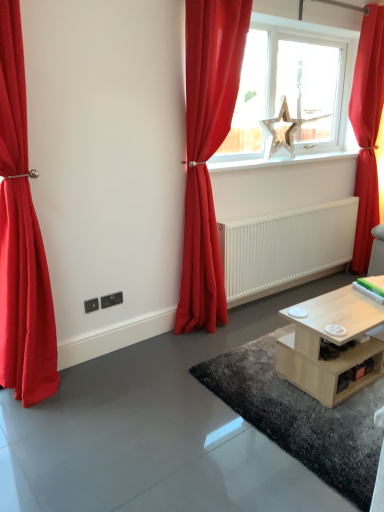
The height and width of the screenshot is (512, 384). I want to click on free point below matte red curtain at left, the first curtain positioned from the left (from a real-world perspective), so click(38, 398).